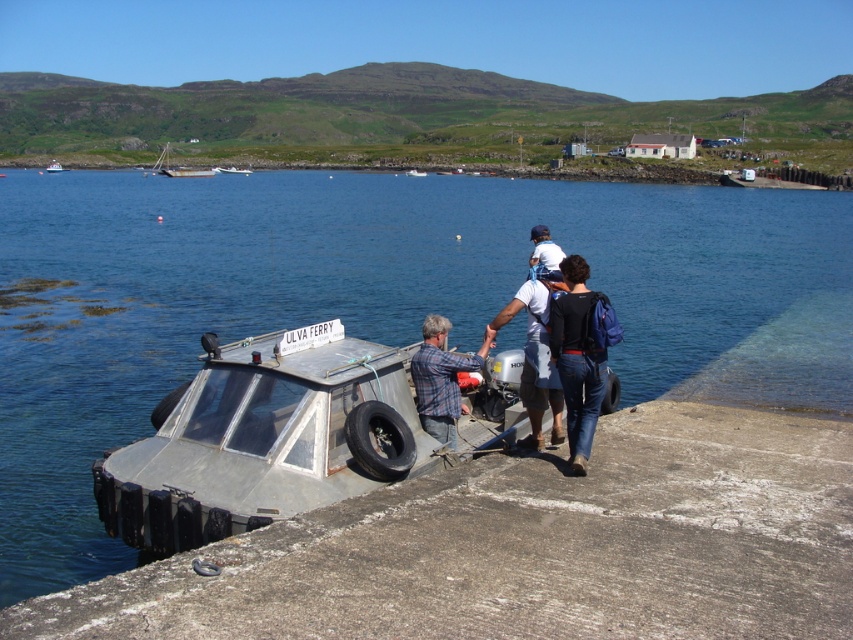
Does plaid fabric shirt at center have a greater height compared to rusty metal boat at upper center?

No, plaid fabric shirt at center is not taller than rusty metal boat at upper center.

Who is more forward, (x=422, y=333) or (x=213, y=176)?

Positioned in front is point (x=422, y=333).

The width and height of the screenshot is (853, 640). What are the coordinates of `plaid fabric shirt at center` in the screenshot? It's located at click(x=440, y=380).

Which is above, black fabric backpack at center or dark blue shirt at center?

black fabric backpack at center is above.

Where is `black fabric backpack at center`? black fabric backpack at center is located at coordinates (577, 358).

Between rusty metal boat at center and dark blue shirt at center, which one has more height?

rusty metal boat at center is taller.

Identify the location of rusty metal boat at center. This screenshot has width=853, height=640. (264, 440).

This screenshot has width=853, height=640. I want to click on rusty metal boat at center, so click(x=264, y=440).